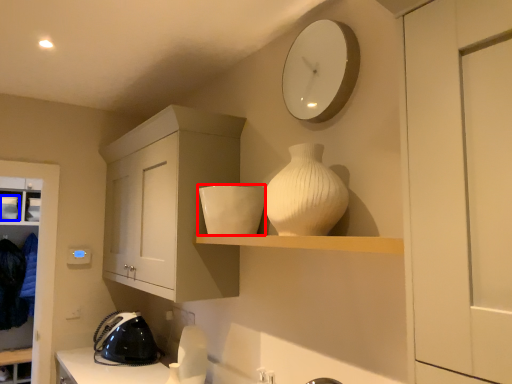
Question: Which object is closer to the camera taking this photo, appliance (highlighted by a red box) or appliance (highlighted by a blue box)?

Choices:
 (A) appliance
 (B) appliance

Answer: (A)